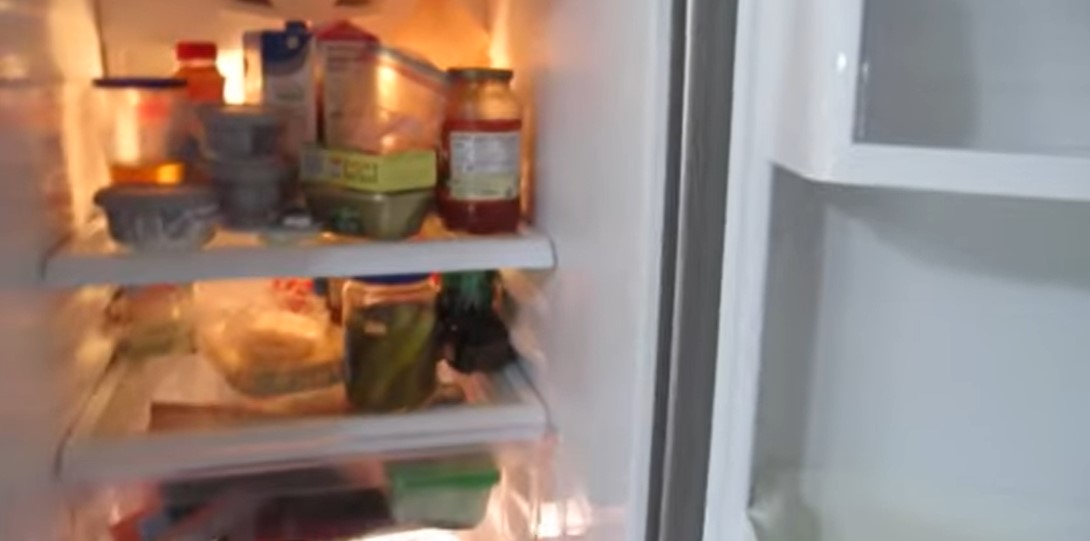
Identify the location of fridge door compartment. Image resolution: width=1090 pixels, height=541 pixels. (970, 54).